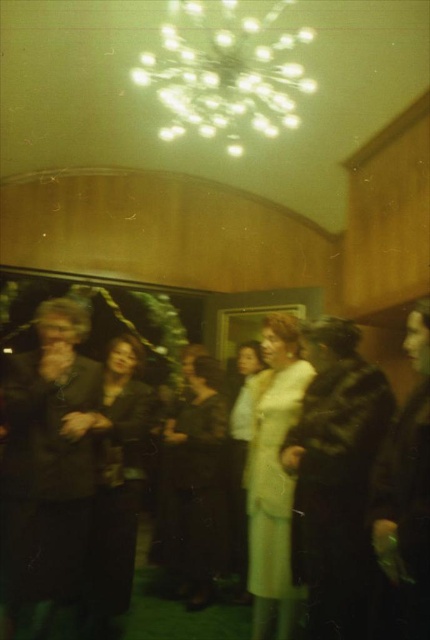
Question: Which object is farther from the camera taking this photo?

Choices:
 (A) dark brown leather jacket at left
 (B) white satin dress at center
 (C) light yellow fabric coat at center

Answer: (B)

Question: Which of the following is the farthest from the observer?

Choices:
 (A) (328, 525)
 (B) (264, 390)
 (C) (205, 545)

Answer: (C)

Question: In this image, where is light yellow fabric coat at center located relative to leather jacket at right?

Choices:
 (A) below
 (B) above

Answer: (A)

Question: Does velvet black dress at center come in front of white satin dress at center?

Choices:
 (A) no
 (B) yes

Answer: (B)

Question: Which of the following is the farthest from the observer?

Choices:
 (A) (401, 620)
 (B) (263, 515)
 (C) (134, 472)
 (D) (340, 349)

Answer: (C)

Question: Does dark brown leather jacket at left have a smaller size compared to shiny black coat at center?

Choices:
 (A) no
 (B) yes

Answer: (A)